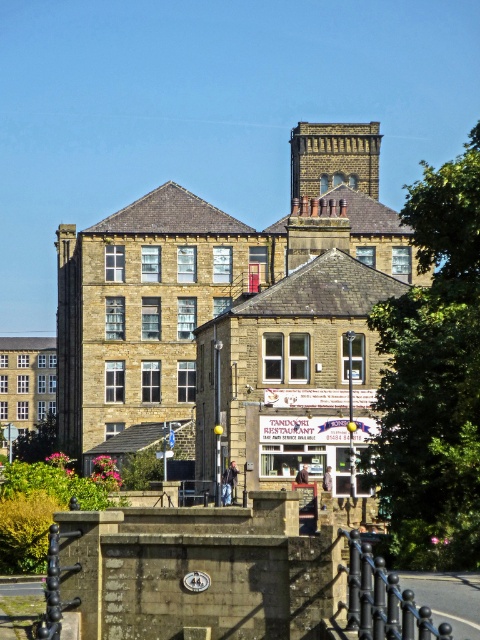
Is point (391, 605) positioned behind point (324, 184)?

That is False.

Between point (337, 566) and point (305, 193), which one is positioned in front?

Point (337, 566) is in front.

Does point (364, 568) lie behind point (361, 173)?

No, (364, 568) is closer to viewer.

This screenshot has height=640, width=480. I want to click on black metal railing at lower center, so click(x=381, y=600).